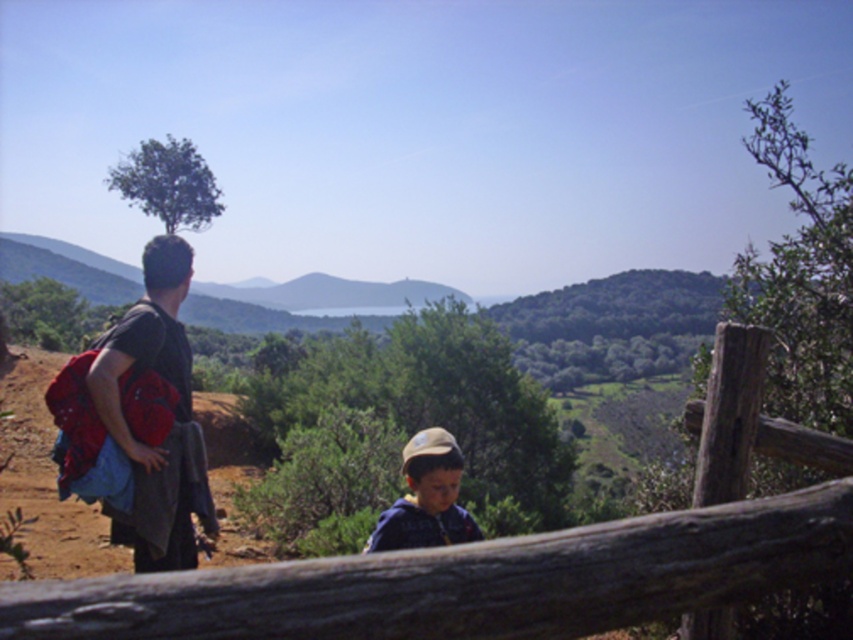
Question: Among these objects, which one is nearest to the camera?

Choices:
 (A) wooden log at center
 (B) blue cotton shirt at center

Answer: (A)

Question: Does matte black backpack at left appear on the left side of blue cotton shirt at center?

Choices:
 (A) no
 (B) yes

Answer: (B)

Question: Can you confirm if matte black backpack at left is wider than blue cotton shirt at center?

Choices:
 (A) yes
 (B) no

Answer: (A)

Question: Which of these objects is positioned closest to the matte black backpack at left?

Choices:
 (A) blue cotton shirt at center
 (B) wooden log at center

Answer: (A)

Question: Observing the image, what is the correct spatial positioning of matte black backpack at left in reference to blue cotton shirt at center?

Choices:
 (A) left
 (B) right

Answer: (A)

Question: Among these objects, which one is nearest to the camera?

Choices:
 (A) wooden log at center
 (B) blue cotton shirt at center

Answer: (A)